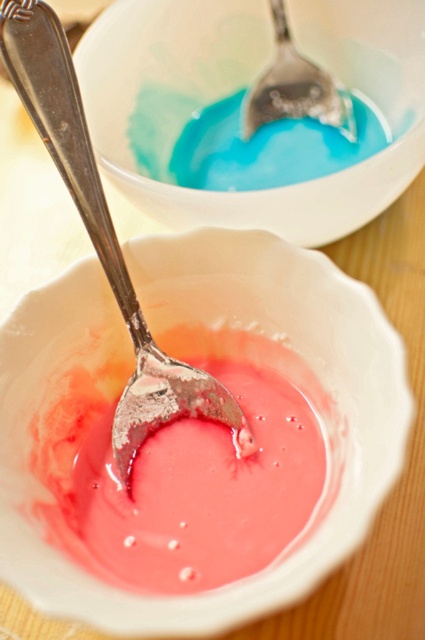
You are a food stylist arranging a photo shoot and need to place a garnish precisely at the center of the matte pink bowl at center. Given the coordinates provided, can you confirm if the point marked at [210,324] is indeed the center of the bowl?

Yes, the point marked at [210,324] corresponds to the center of the matte pink bowl at center, so you can place the garnish there accurately.

Based on the photo, you are taking a photo of the two bowls and notice two points marked in the image. Which point, point (x=357, y=380) or point (x=365, y=168), appears closer to you in the photo?

Point (x=357, y=380) is closer to the camera than point (x=365, y=168), so it appears closer to you in the photo.

You are arranging a dessert display and need to place a decorative plate between the matte white bowl at upper center and the polished silver spoon at center. Based on their positions, where should you position the plate?

The matte white bowl at upper center is located above the polished silver spoon at center, so you should place the decorative plate below the matte white bowl at upper center and above the polished silver spoon at center to fit between them.